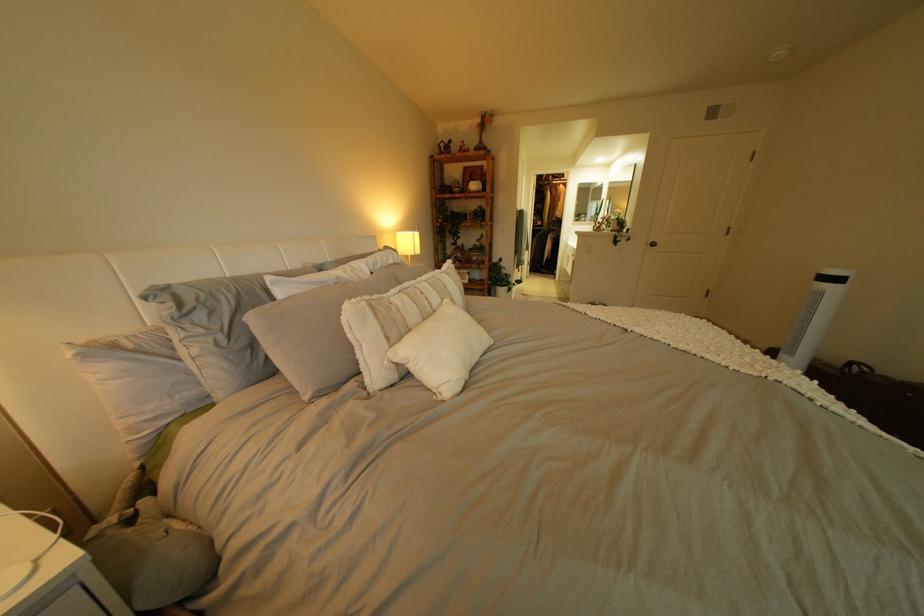
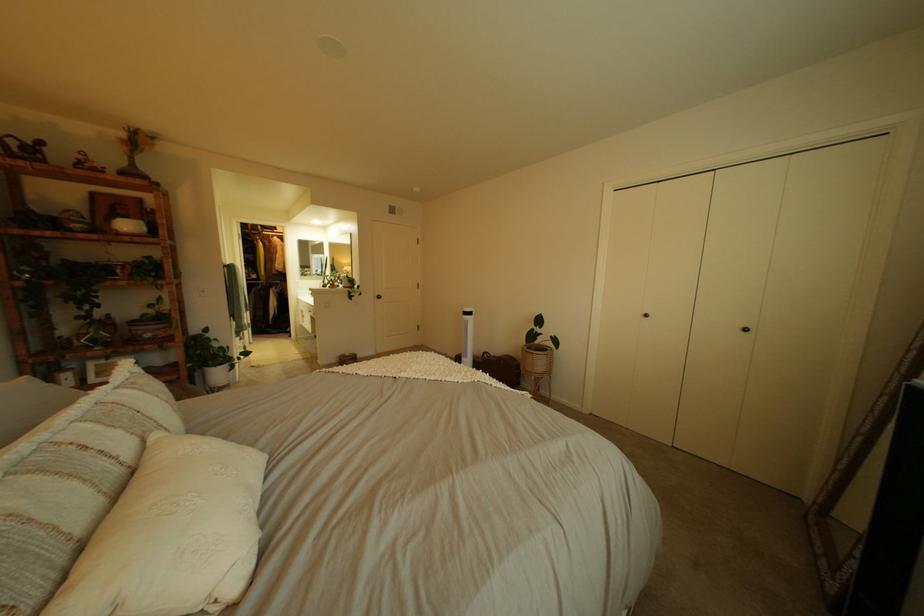
Question: How did the camera likely rotate?

Choices:
 (A) Left
 (B) Right
 (C) Up
 (D) Down

Answer: (B)